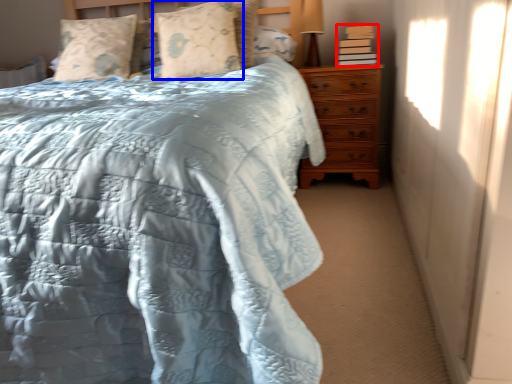
Question: Which object is further to the camera taking this photo, book (highlighted by a red box) or pillow (highlighted by a blue box)?

Choices:
 (A) book
 (B) pillow

Answer: (A)